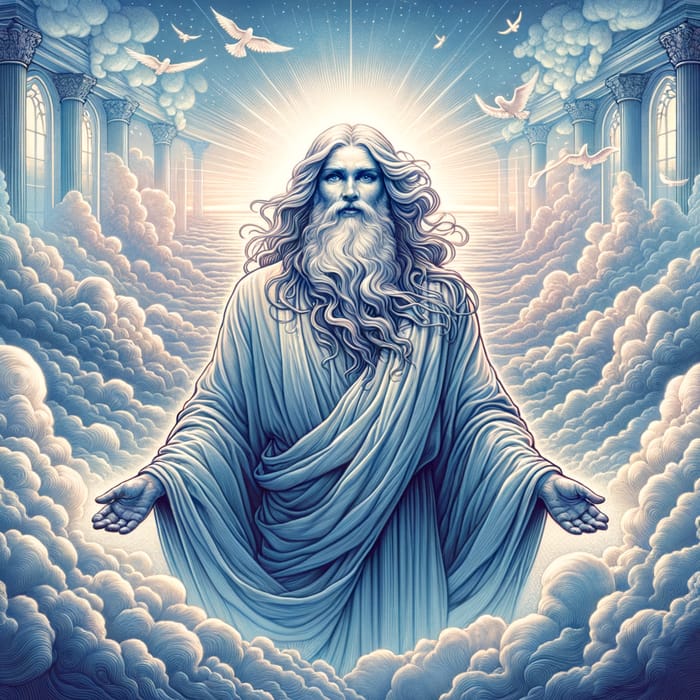
At what (x,y) coordinates should I click in order to perform the action: click on light. Please return your answer as a coordinate pair (x, y). The width and height of the screenshot is (700, 700). Looking at the image, I should click on (379, 92).